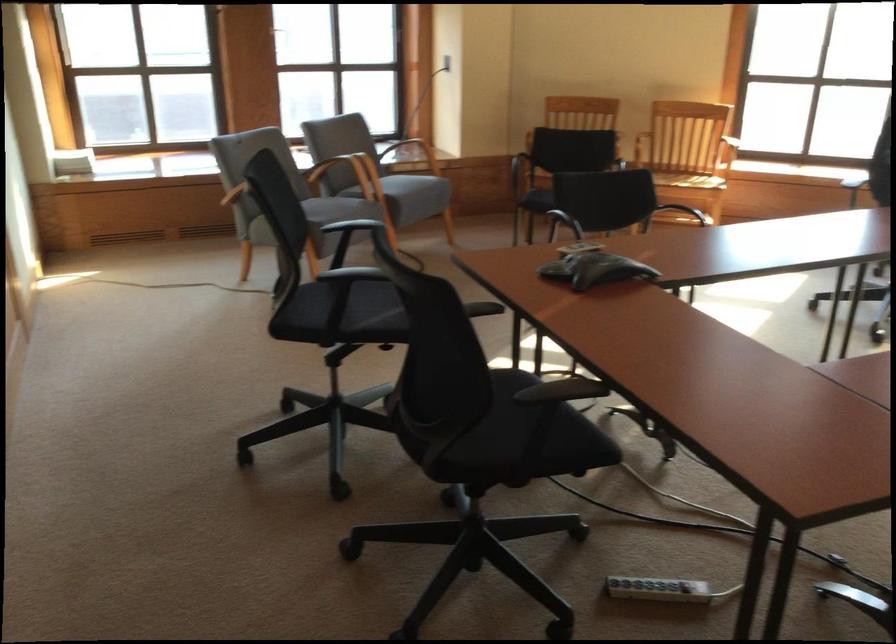
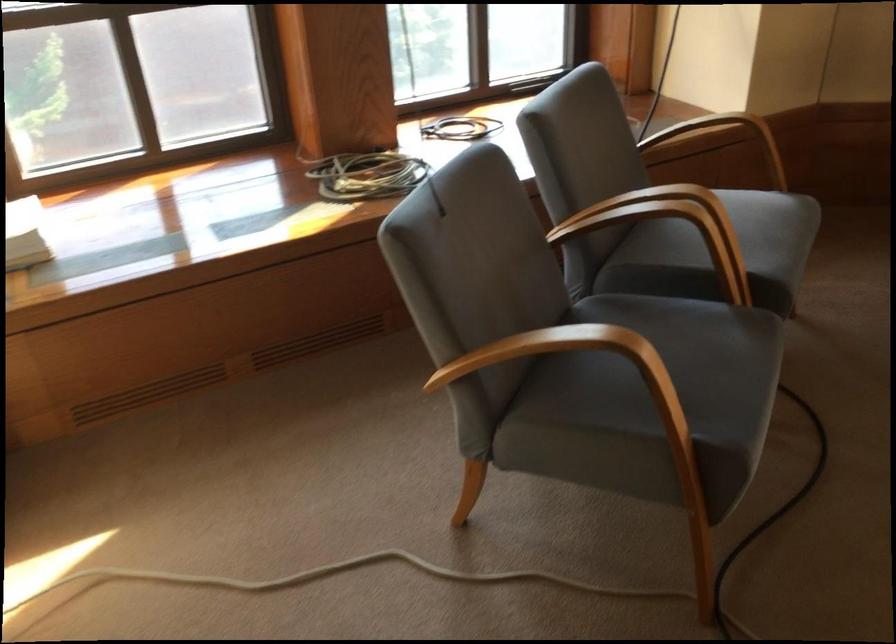
The images are taken continuously from a first-person perspective. In which direction are you moving?

The cameraman moved toward left, forward.